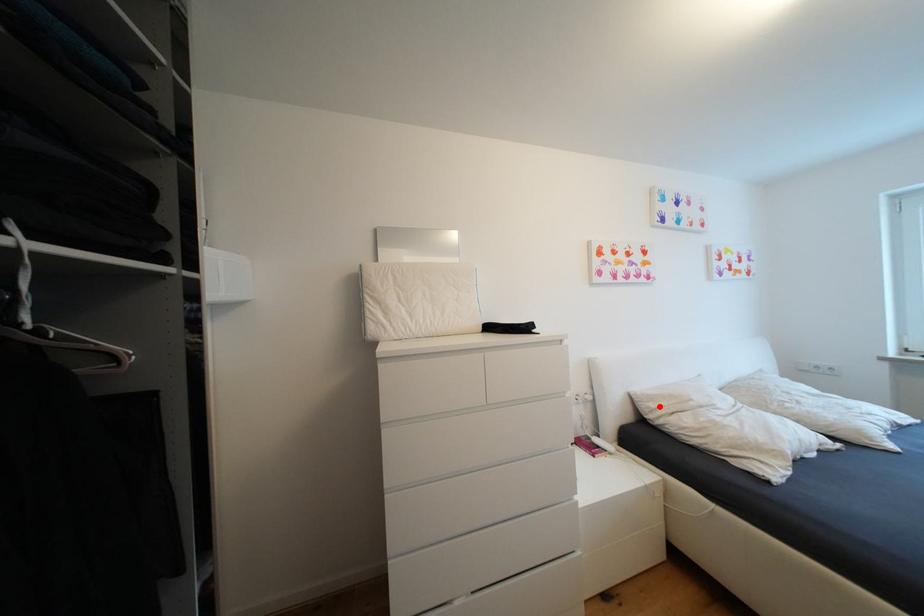
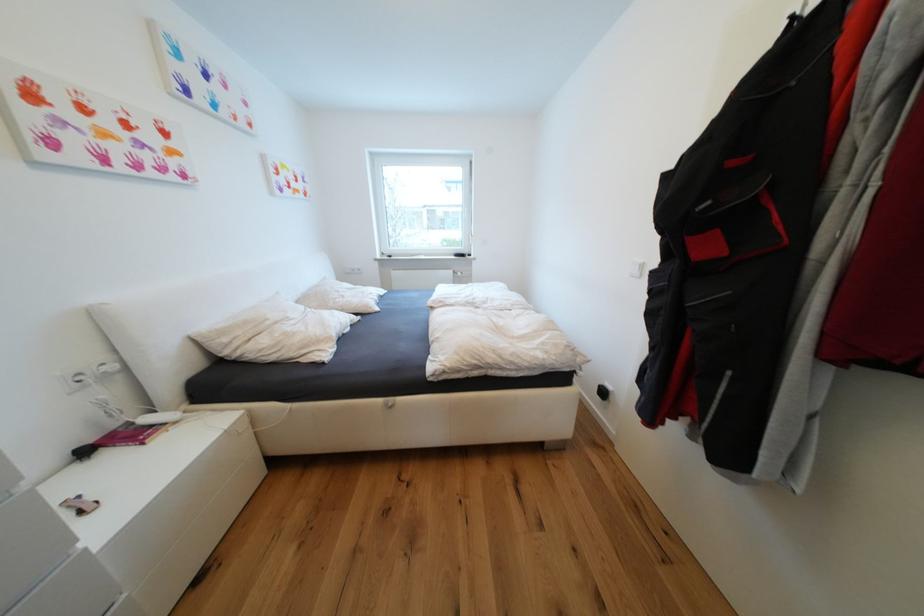
Where in the second image is the point corresponding to the highlighted location from the first image?

(233, 341)